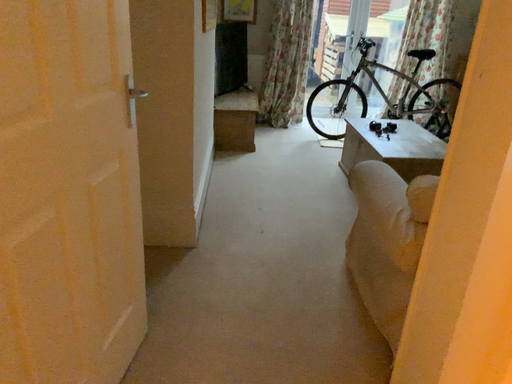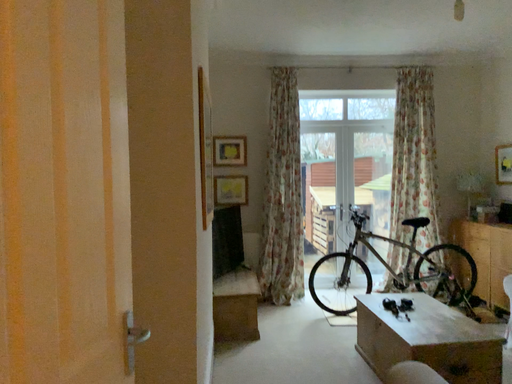
Question: How did the camera likely rotate when shooting the video?

Choices:
 (A) rotated upward
 (B) rotated downward

Answer: (A)